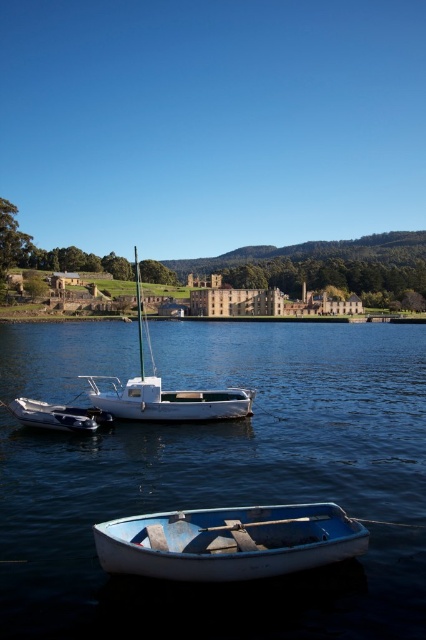
From the picture: You are a photographer planning to capture the reflection of the historic buildings in the blue glossy water at center. However, you notice the metallic blue dinghy at lower center might obstruct the reflection. Based on their heights, can the dinghy block the reflection of the buildings?

The blue glossy water at center has a greater height compared to the metallic blue dinghy at lower center, so the water is higher than the dinghy. Therefore, the metallic blue dinghy at lower center cannot block the reflection of the buildings in the blue glossy water at center since it is lower in height.

You are standing at the origin point of the image. You see two points marked as point (149, 404) and point (6, 404). Which point is farther away from you?

Point (149, 404) is behind point (6, 404), so it is farther away from you.

You are a tour guide leading a group to the historic buildings. You need to move from the white matte rowboat at lower center to the metallic blue dinghy at lower center. Can you walk directly between them without getting wet?

The white matte rowboat at lower center is 22.24 meters away from the metallic blue dinghy at lower center. Since both are anchored near the water edge, the distance between them is too large to walk directly without getting wet unless there is a path. However, the scene description mentions calm blue waters and no mention of a path, so it is likely you would get wet.